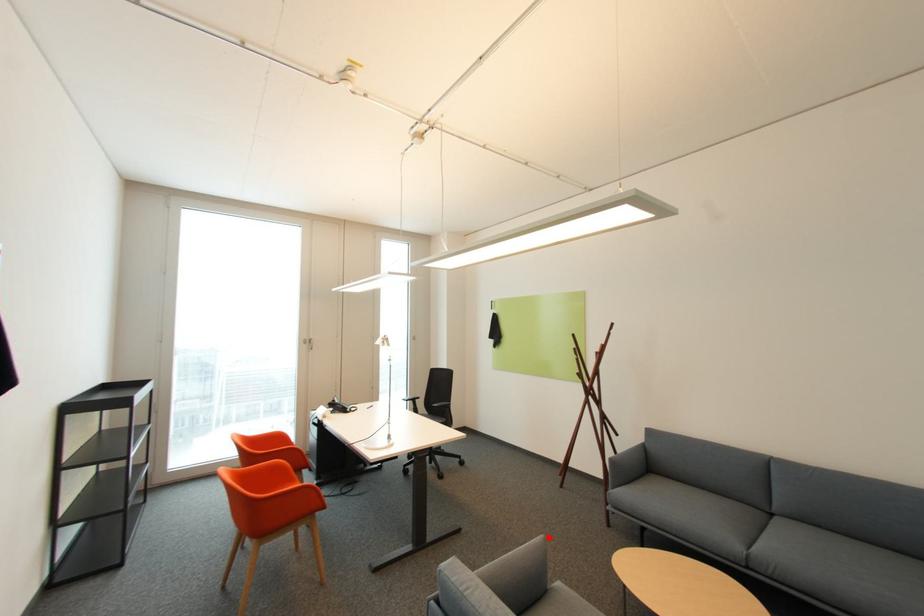
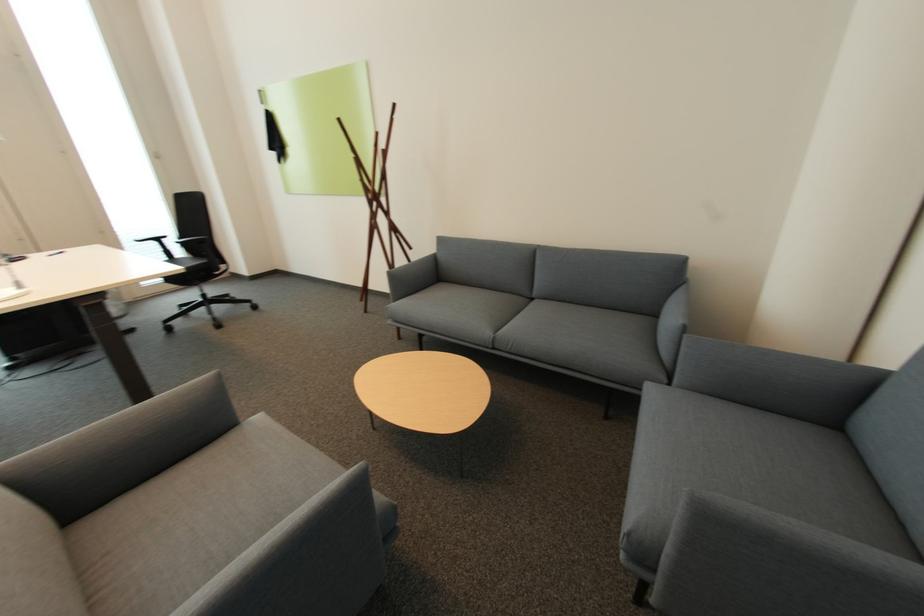
In the second image, find the point that corresponds to the highlighted location in the first image.

(219, 373)